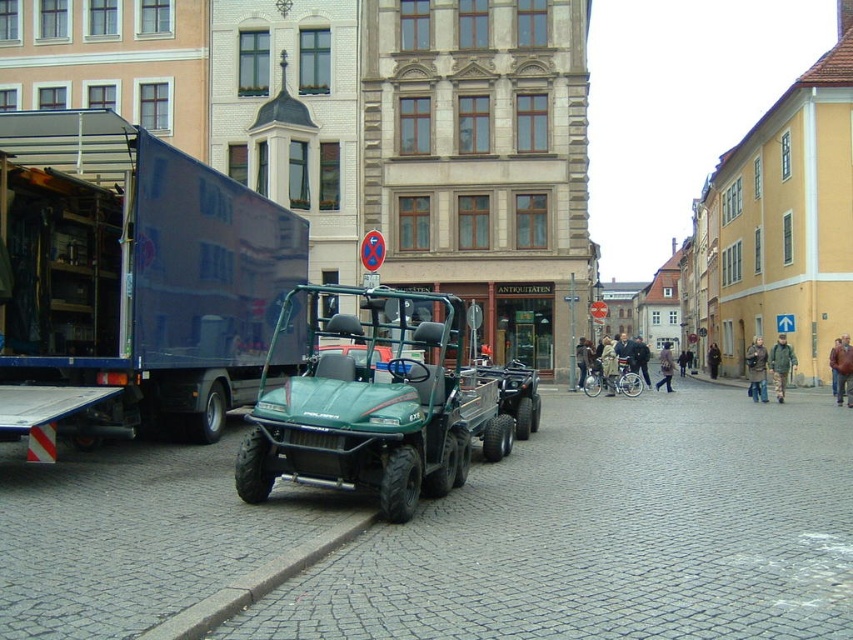
Which is below, blue metallic truck at left or green matte utility vehicle at center?

green matte utility vehicle at center

Which is more to the left, blue metallic truck at left or green matte utility vehicle at center?

From the viewer's perspective, blue metallic truck at left appears more on the left side.

You are a GUI agent. You are given a task and a screenshot of the screen. Output one action in this format:
    pyautogui.click(x=<x>, y=<y>)
    Task: Click on the blue metallic truck at left
    The image size is (853, 640).
    Given the screenshot: What is the action you would take?
    pyautogui.click(x=134, y=276)